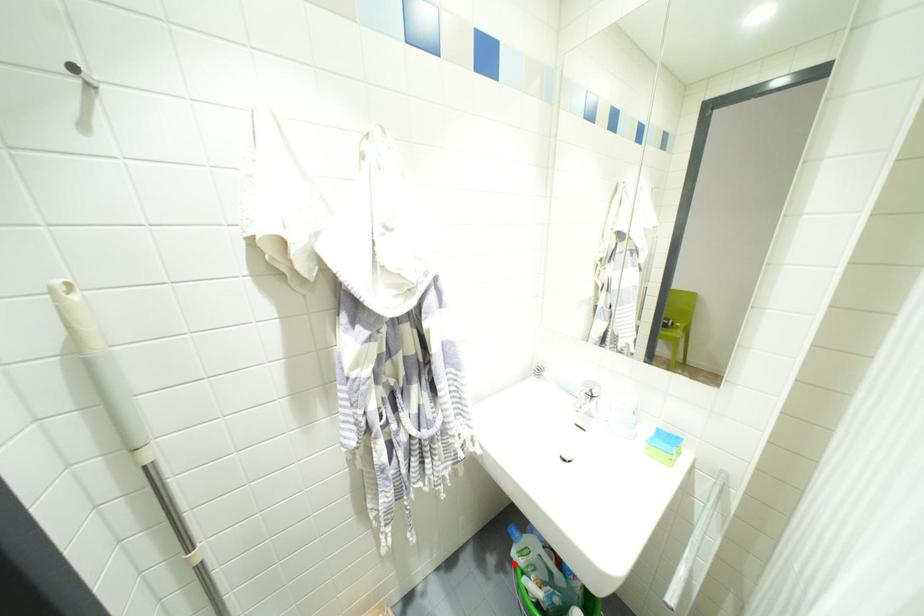
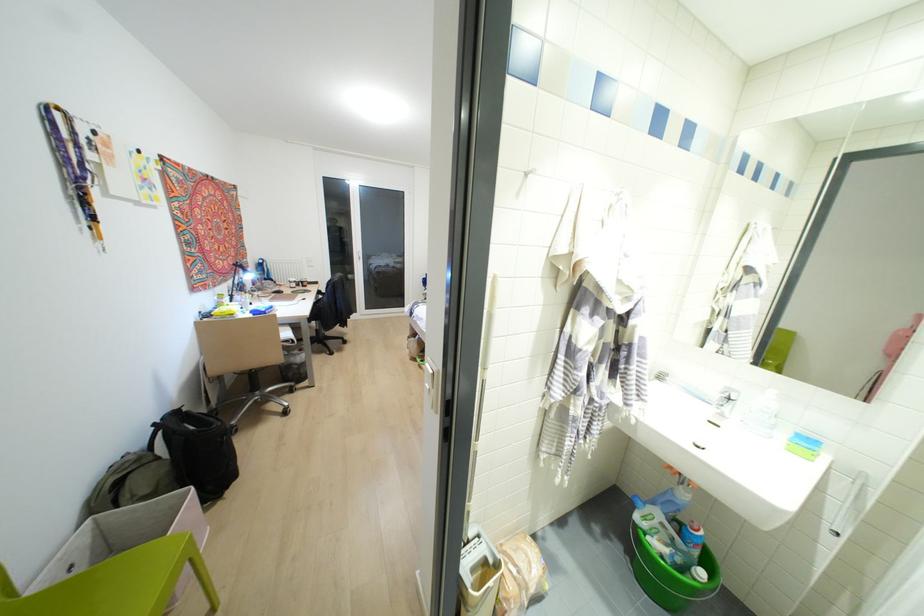
In the second image, find the point that corresponds to the highlighted location in the first image.

(636, 525)